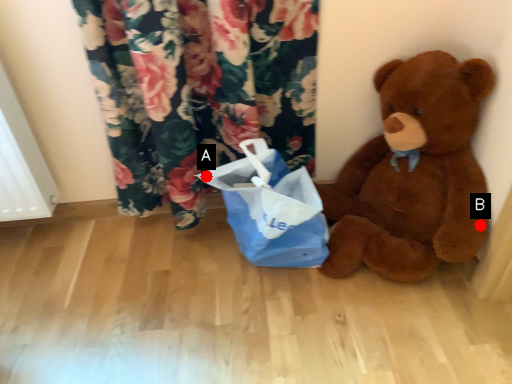
Question: Two points are circled on the image, labeled by A and B beside each circle. Which point is farther to the camera?

Choices:
 (A) A is further
 (B) B is further

Answer: (A)